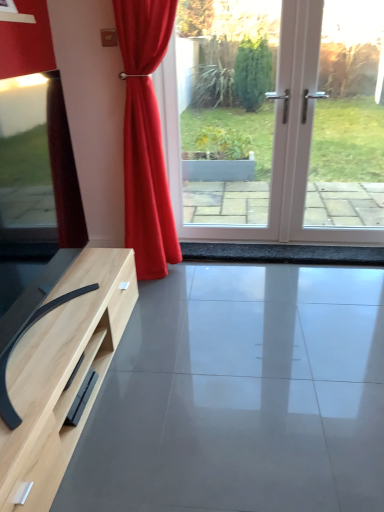
Question: Is matte wood tv stand at lower left to the left or to the right of satin red curtain at center in the image?

Choices:
 (A) right
 (B) left

Answer: (A)

Question: Considering the positions of matte wood tv stand at lower left and satin red curtain at center in the image, is matte wood tv stand at lower left wider or thinner than satin red curtain at center?

Choices:
 (A) wide
 (B) thin

Answer: (A)

Question: Considering the real-world distances, which object is farthest from the white glossy screen door at center?

Choices:
 (A) satin red curtain at center
 (B) matte wood tv stand at lower left

Answer: (B)

Question: Which is nearer to the matte wood tv stand at lower left?

Choices:
 (A) white glossy screen door at center
 (B) satin red curtain at center

Answer: (B)